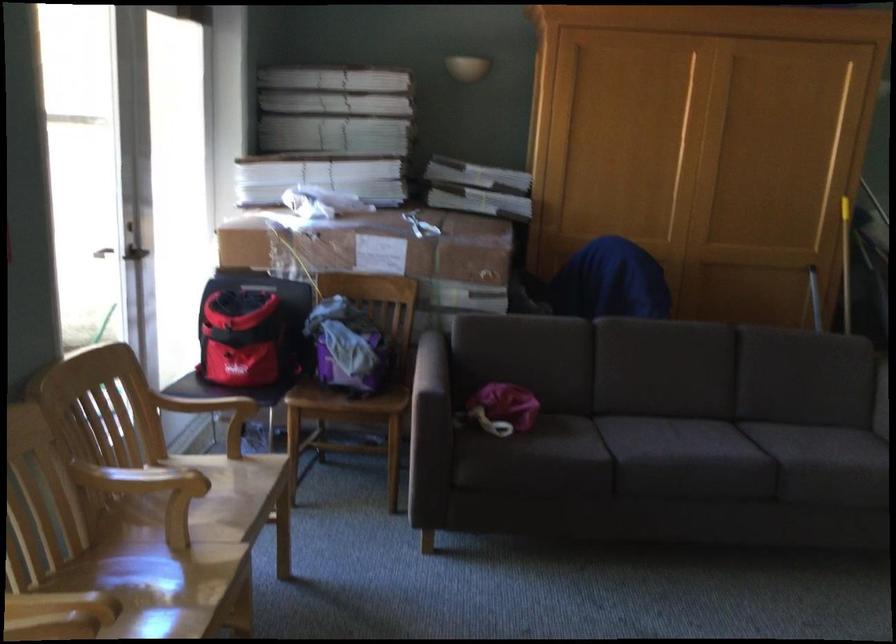
The width and height of the screenshot is (896, 644). Find the location of `wooden chair armrest`. wooden chair armrest is located at coordinates (204, 404).